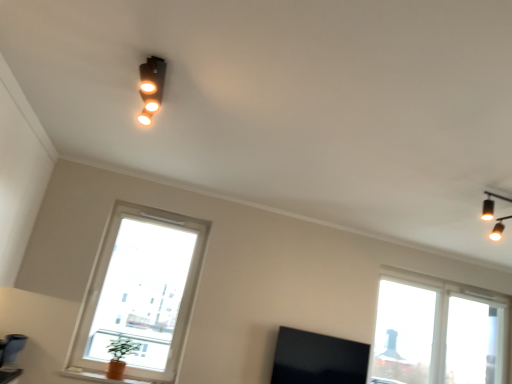
This screenshot has height=384, width=512. Describe the element at coordinates (318, 359) in the screenshot. I see `black matte tv at lower center` at that location.

This screenshot has height=384, width=512. What do you see at coordinates (97, 377) in the screenshot?
I see `matte orange vase at lower left` at bounding box center [97, 377].

This screenshot has width=512, height=384. Describe the element at coordinates (474, 342) in the screenshot. I see `white plastic window frame at right` at that location.

Locate an element on the screen. The height and width of the screenshot is (384, 512). matte black spotlight at upper center is located at coordinates (151, 87).

Is transparent glass window at right, which is the 2th window from front to back, not within matte black spotlight at upper center?

Yes, transparent glass window at right, which is the 2th window from front to back, is located beyond the bounds of matte black spotlight at upper center.

Based on their sizes in the image, would you say transparent glass window at right, positioned as the 1th window in right-to-left order, is bigger or smaller than matte black spotlight at upper center?

Clearly, transparent glass window at right, positioned as the 1th window in right-to-left order, is larger in size than matte black spotlight at upper center.

Is point (433, 303) positioned after point (160, 102)?

Yes, it is behind point (160, 102).

Is the position of white plastic window frame at right more distant than that of transparent glass window at lower left, placed as the first window when sorted from left to right?

Yes, it is.

Does white plastic window frame at right contain transparent glass window at lower left, placed as the first window when sorted from left to right?

Actually, transparent glass window at lower left, placed as the first window when sorted from left to right, is outside white plastic window frame at right.

What's the angular difference between white plastic window frame at right and transparent glass window at lower left, positioned as the second window in right-to-left order,'s facing directions?

2.07 degrees separate the facing orientations of white plastic window frame at right and transparent glass window at lower left, positioned as the second window in right-to-left order.

Is black matte tv at lower center not near transparent glass window at lower left, the second window in the back-to-front sequence?

Yes, black matte tv at lower center and transparent glass window at lower left, the second window in the back-to-front sequence, are quite far apart.

Is black matte tv at lower center oriented towards transparent glass window at lower left, the first window when ordered from front to back?

No, black matte tv at lower center is not facing towards transparent glass window at lower left, the first window when ordered from front to back.

Consider the image. From their relative heights in the image, would you say transparent glass window at lower left, placed as the first window when sorted from left to right, is taller or shorter than white plastic window frame at right?

Considering their sizes, transparent glass window at lower left, placed as the first window when sorted from left to right, has more height than white plastic window frame at right.

Considering the positions of objects transparent glass window at lower left, the first window when ordered from front to back, and white plastic window frame at right in the image provided, who is behind, transparent glass window at lower left, the first window when ordered from front to back, or white plastic window frame at right?

white plastic window frame at right is further from the camera.

Which is more to the left, transparent glass window at lower left, the second window in the back-to-front sequence, or white plastic window frame at right?

From the viewer's perspective, transparent glass window at lower left, the second window in the back-to-front sequence, appears more on the left side.

From the image's perspective, who appears lower, transparent glass window at right, the first window viewed from the back, or white plastic window frame at right?

From the image's view, white plastic window frame at right is below.

Who is smaller, transparent glass window at right, which is the 2th window from front to back, or white plastic window frame at right?

Smaller between the two is white plastic window frame at right.

Does point (425, 380) come in front of point (501, 353)?

Yes.

Is transparent glass window at right, positioned as the 1th window in right-to-left order, shorter than white plastic window frame at right?

No.

Does black matte tv at lower center contain green leafy plant at lower left?

Definitely not — green leafy plant at lower left is not inside black matte tv at lower center.

Which is behind, point (290, 342) or point (106, 349)?

The point (290, 342) is behind.

Considering the sizes of black matte tv at lower center and green leafy plant at lower left in the image, is black matte tv at lower center bigger or smaller than green leafy plant at lower left?

Considering their sizes, black matte tv at lower center takes up more space than green leafy plant at lower left.

Is the position of black matte tv at lower center more distant than that of green leafy plant at lower left?

Yes.

Based on the photo, is matte orange vase at lower left bigger than matte black spotlight at upper center?

No, matte orange vase at lower left is not bigger than matte black spotlight at upper center.

Is matte orange vase at lower left positioned far away from matte black spotlight at upper center?

matte orange vase at lower left is far away from matte black spotlight at upper center.

Is matte orange vase at lower left spatially inside matte black spotlight at upper center, or outside of it?

matte orange vase at lower left is spatially situated outside matte black spotlight at upper center.

Is matte orange vase at lower left turned away from matte black spotlight at upper center?

No, matte orange vase at lower left is not facing the opposite direction of matte black spotlight at upper center.

Identify the location of the 1st window directly beneath the matte black spotlight at upper center (from a real-world perspective). The height and width of the screenshot is (384, 512). (438, 328).

Identify the location of window frame behind the transparent glass window at lower left, the second window in the back-to-front sequence. (474, 342).

Based on their spatial positions, is transparent glass window at lower left, placed as the first window when sorted from left to right, or matte orange vase at lower left further from matte black spotlight at upper center?

The object further to matte black spotlight at upper center is matte orange vase at lower left.

Looking at the image, which one is located closer to transparent glass window at right, which is the 2th window from front to back, black matte tv at lower center or transparent glass window at lower left, the second window in the back-to-front sequence?

Answer: Among the two, black matte tv at lower center is located nearer to transparent glass window at right, which is the 2th window from front to back.

From the image, which object appears to be farther from matte orange vase at lower left, black matte tv at lower center or white plastic window frame at right?

white plastic window frame at right is positioned further to the anchor matte orange vase at lower left.

Considering their positions, is matte orange vase at lower left positioned further to green leafy plant at lower left than matte black spotlight at upper center?

matte black spotlight at upper center is further to green leafy plant at lower left.

Which object lies further to the anchor point green leafy plant at lower left, black matte tv at lower center or matte orange vase at lower left?

The object further to green leafy plant at lower left is black matte tv at lower center.

Based on their spatial positions, is matte black spotlight at upper center or white plastic window frame at right closer to transparent glass window at right, which is the 2th window from front to back?

white plastic window frame at right is positioned closer to the anchor transparent glass window at right, which is the 2th window from front to back.

From the image, which object appears to be farther from transparent glass window at lower left, the second window in the back-to-front sequence, matte orange vase at lower left or matte black spotlight at upper center?

matte black spotlight at upper center is further to transparent glass window at lower left, the second window in the back-to-front sequence.

Considering their positions, is white plastic window frame at right positioned further to matte orange vase at lower left than green leafy plant at lower left?

Among the two, white plastic window frame at right is located further to matte orange vase at lower left.

Locate an element on the screen. This screenshot has width=512, height=384. window located between green leafy plant at lower left and transparent glass window at right, the first window viewed from the back, in the left-right direction is located at coordinates click(x=142, y=291).

Where is `window between matte orange vase at lower left and transparent glass window at right, the first window viewed from the back`? This screenshot has height=384, width=512. window between matte orange vase at lower left and transparent glass window at right, the first window viewed from the back is located at coordinates (142, 291).

The height and width of the screenshot is (384, 512). Identify the location of window screen between matte black spotlight at upper center and white plastic window frame at right. (318, 359).

The image size is (512, 384). I want to click on window between matte black spotlight at upper center and black matte tv at lower center vertically, so click(142, 291).